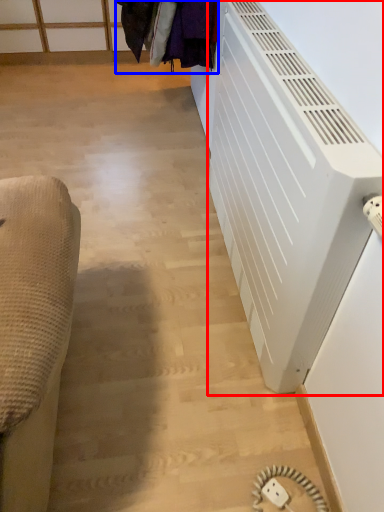
Question: Which object appears closest to the camera in this image, air conditioning (highlighted by a red box) or laundry (highlighted by a blue box)?

Choices:
 (A) air conditioning
 (B) laundry

Answer: (A)